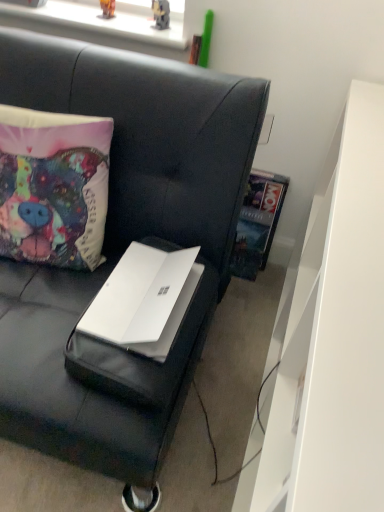
Question: Is white matte laptop at center not near metallic plastic toy at upper center, the second toy in the left-to-right sequence?

Choices:
 (A) no
 (B) yes

Answer: (A)

Question: Is white matte laptop at center in front of metallic plastic toy at upper center, the second toy in the left-to-right sequence?

Choices:
 (A) no
 (B) yes

Answer: (B)

Question: Does white matte laptop at center have a larger size compared to metallic plastic toy at upper center, the 1th toy positioned from the right?

Choices:
 (A) no
 (B) yes

Answer: (B)

Question: Is white matte laptop at center to the right of metallic plastic toy at upper center, the 1th toy positioned from the right, from the viewer's perspective?

Choices:
 (A) no
 (B) yes

Answer: (A)

Question: Is white matte laptop at center outside metallic plastic toy at upper center, the second toy in the left-to-right sequence?

Choices:
 (A) no
 (B) yes

Answer: (B)

Question: Is metallic plastic toy at upper center, the second toy in the left-to-right sequence, at the back of white matte laptop at center?

Choices:
 (A) no
 (B) yes

Answer: (A)

Question: Considering the relative sizes of metallic plastic toy at upper center, the 1th toy positioned from the right, and matte fabric pillow at left in the image provided, is metallic plastic toy at upper center, the 1th toy positioned from the right, taller than matte fabric pillow at left?

Choices:
 (A) yes
 (B) no

Answer: (B)

Question: From the image's perspective, is metallic plastic toy at upper center, the second toy in the left-to-right sequence, beneath matte fabric pillow at left?

Choices:
 (A) yes
 (B) no

Answer: (B)

Question: Is the position of metallic plastic toy at upper center, the second toy in the left-to-right sequence, more distant than that of matte fabric pillow at left?

Choices:
 (A) yes
 (B) no

Answer: (A)

Question: Can you see metallic plastic toy at upper center, the 1th toy positioned from the right, touching matte fabric pillow at left?

Choices:
 (A) yes
 (B) no

Answer: (B)

Question: Considering the relative positions of metallic plastic toy at upper center, the second toy in the left-to-right sequence, and matte fabric pillow at left in the image provided, is metallic plastic toy at upper center, the second toy in the left-to-right sequence, in front of matte fabric pillow at left?

Choices:
 (A) yes
 (B) no

Answer: (B)

Question: Does metallic plastic toy at upper center, the 1th toy positioned from the right, appear on the left side of matte fabric pillow at left?

Choices:
 (A) no
 (B) yes

Answer: (A)

Question: Is matte fabric pillow at left looking in the opposite direction of metallic plastic toy at upper center, the second toy in the left-to-right sequence?

Choices:
 (A) yes
 (B) no

Answer: (A)